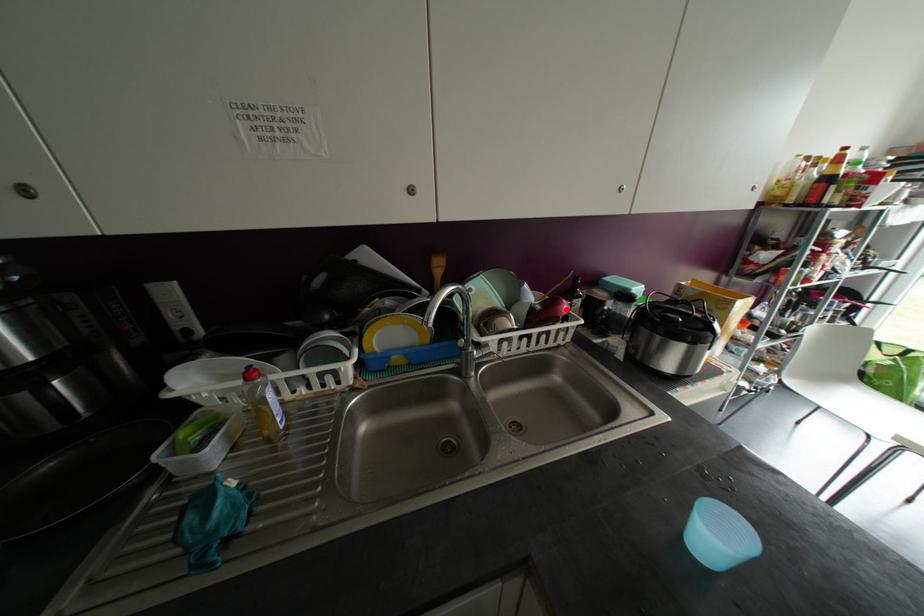
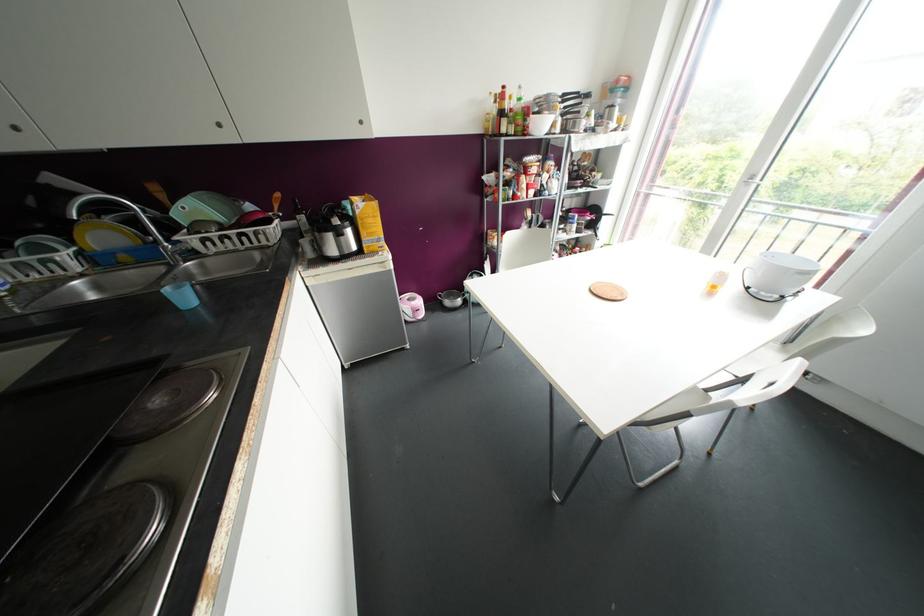
Question: I am providing you with two images of the same scene from different viewpoints. Image1 has a red point marked. In image2, the corresponding 3D location appears at what relative position? Reply with the corresponding letter.

Choices:
 (A) Closer
 (B) Farther

Answer: (A)